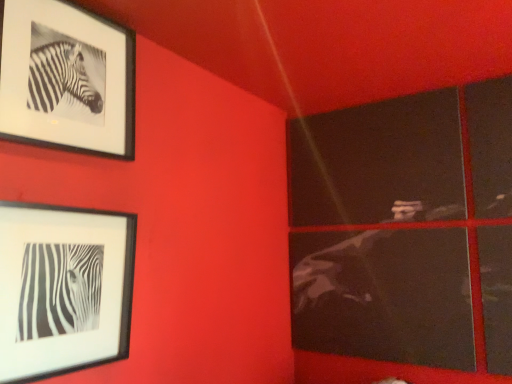
Question: Is black matte picture frame at upper left, arranged as the 2th picture frame when ordered from the bottom, shorter than black matte picture frame at lower left, the 2th picture frame from the top?

Choices:
 (A) no
 (B) yes

Answer: (A)

Question: Is black matte picture frame at upper left, which is counted as the 1th picture frame, starting from the top, at the left side of black matte picture frame at lower left, the 2th picture frame from the top?

Choices:
 (A) yes
 (B) no

Answer: (A)

Question: Is black matte picture frame at upper left, which is counted as the 1th picture frame, starting from the top, facing towards black matte picture frame at lower left, placed as the first picture frame when sorted from bottom to top?

Choices:
 (A) no
 (B) yes

Answer: (A)

Question: Considering the relative sizes of black matte picture frame at upper left, which is counted as the 1th picture frame, starting from the top, and black matte picture frame at lower left, placed as the first picture frame when sorted from bottom to top, in the image provided, is black matte picture frame at upper left, which is counted as the 1th picture frame, starting from the top, thinner than black matte picture frame at lower left, placed as the first picture frame when sorted from bottom to top,?

Choices:
 (A) yes
 (B) no

Answer: (A)

Question: Is black matte picture frame at upper left, which is counted as the 1th picture frame, starting from the top, positioned far away from black matte picture frame at lower left, placed as the first picture frame when sorted from bottom to top?

Choices:
 (A) no
 (B) yes

Answer: (A)

Question: From the image's perspective, would you say black matte picture frame at upper left, arranged as the 2th picture frame when ordered from the bottom, is positioned over black matte picture frame at lower left, placed as the first picture frame when sorted from bottom to top?

Choices:
 (A) no
 (B) yes

Answer: (B)

Question: Is black matte picture frame at lower left, placed as the first picture frame when sorted from bottom to top, positioned with its back to black matte picture frame at upper left, which is counted as the 1th picture frame, starting from the top?

Choices:
 (A) yes
 (B) no

Answer: (B)

Question: Is black matte picture frame at upper left, which is counted as the 1th picture frame, starting from the top, a part of black matte picture frame at lower left, the 2th picture frame from the top?

Choices:
 (A) yes
 (B) no

Answer: (B)

Question: From the image's perspective, does black matte picture frame at lower left, placed as the first picture frame when sorted from bottom to top, appear lower than black matte picture frame at upper left, which is counted as the 1th picture frame, starting from the top?

Choices:
 (A) yes
 (B) no

Answer: (A)

Question: Can you confirm if black matte picture frame at lower left, the 2th picture frame from the top, is positioned to the right of black matte picture frame at upper left, which is counted as the 1th picture frame, starting from the top?

Choices:
 (A) yes
 (B) no

Answer: (A)

Question: Does black matte picture frame at lower left, the 2th picture frame from the top, have a larger size compared to black matte picture frame at upper left, arranged as the 2th picture frame when ordered from the bottom?

Choices:
 (A) no
 (B) yes

Answer: (B)

Question: From a real-world perspective, is black matte picture frame at lower left, the 2th picture frame from the top, beneath black matte picture frame at upper left, which is counted as the 1th picture frame, starting from the top?

Choices:
 (A) yes
 (B) no

Answer: (A)

Question: In terms of height, does black matte picture frame at lower left, placed as the first picture frame when sorted from bottom to top, look taller or shorter compared to black matte picture frame at upper left, which is counted as the 1th picture frame, starting from the top?

Choices:
 (A) tall
 (B) short

Answer: (B)